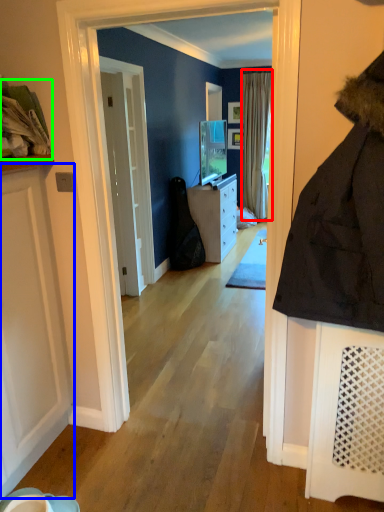
Question: Based on their relative distances, which object is nearer to curtain (highlighted by a red box)? Choose from door (highlighted by a blue box) and laundry (highlighted by a green box).

Choices:
 (A) door
 (B) laundry

Answer: (A)